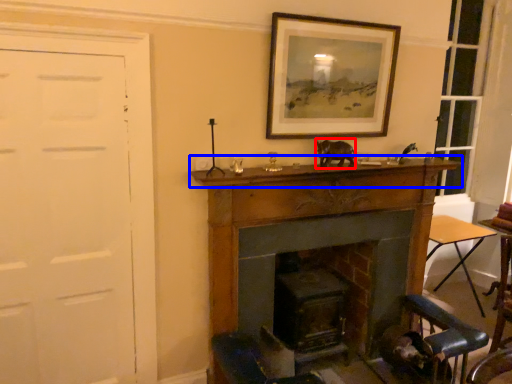
Question: Among these objects, which one is nearest to the camera, animal (highlighted by a red box) or mantle (highlighted by a blue box)?

Choices:
 (A) animal
 (B) mantle

Answer: (B)